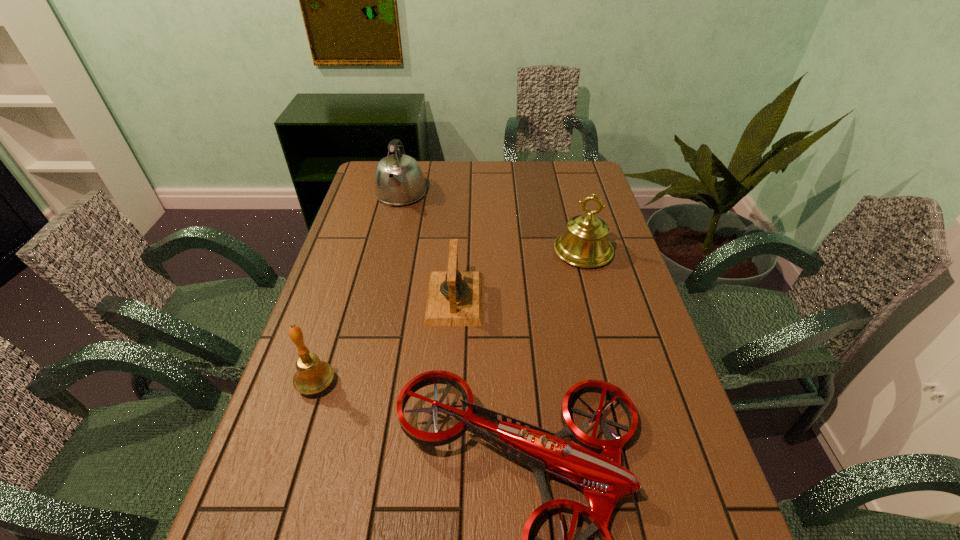
You are a GUI agent. You are given a task and a screenshot of the screen. Output one action in this format:
    pyautogui.click(x=<x>, y=<y>)
    Task: Click on the object positioned at the far edge
    This screenshot has height=540, width=960.
    Given the screenshot: What is the action you would take?
    pyautogui.click(x=398, y=180)

Find the location of a particular element. The image size is (960, 540). kettle that is positioned at the left edge is located at coordinates (398, 180).

At what (x,y) coordinates should I click in order to perform the action: click on bell situated at the left edge. Please return your answer as a coordinate pair (x, y). The height and width of the screenshot is (540, 960). Looking at the image, I should click on 312,376.

Identify the location of object that is at the right edge. (584, 244).

Locate an element on the screen. object that is at the far left corner is located at coordinates (398, 180).

Locate an element on the screen. The height and width of the screenshot is (540, 960). free point at the far edge is located at coordinates (511, 174).

Where is `vacant space at the left edge of the desktop`? The image size is (960, 540). vacant space at the left edge of the desktop is located at coordinates pyautogui.click(x=369, y=228).

Find the location of a particular element. This screenshot has width=960, height=540. vacant space at the right edge of the desktop is located at coordinates (635, 315).

Where is `free space at the far right corner of the desktop`? Image resolution: width=960 pixels, height=540 pixels. free space at the far right corner of the desktop is located at coordinates (567, 168).

At what (x,y) coordinates should I click in order to perform the action: click on free spot between the nearest bell and the kettle. Please return your answer as a coordinate pair (x, y). Looking at the image, I should click on (358, 289).